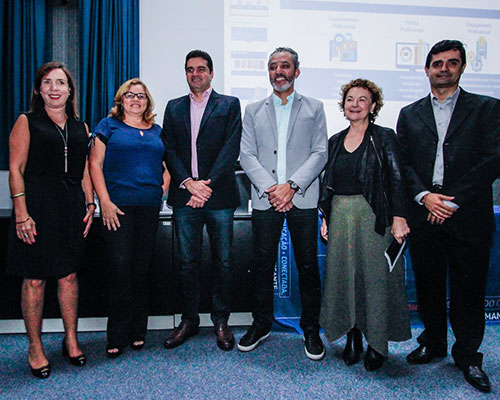
Find the location of a particular element. This screenshot has width=500, height=400. carpet is located at coordinates (286, 375).